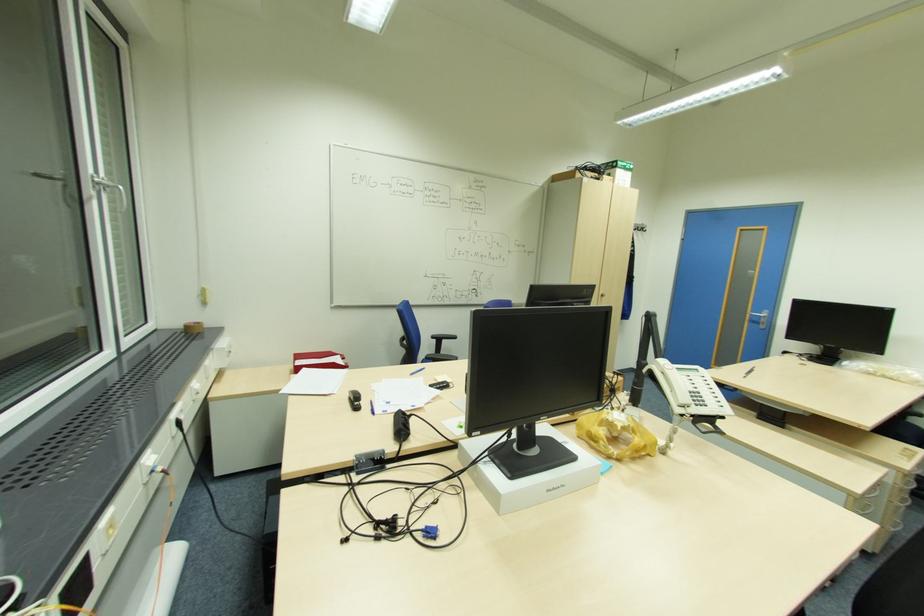
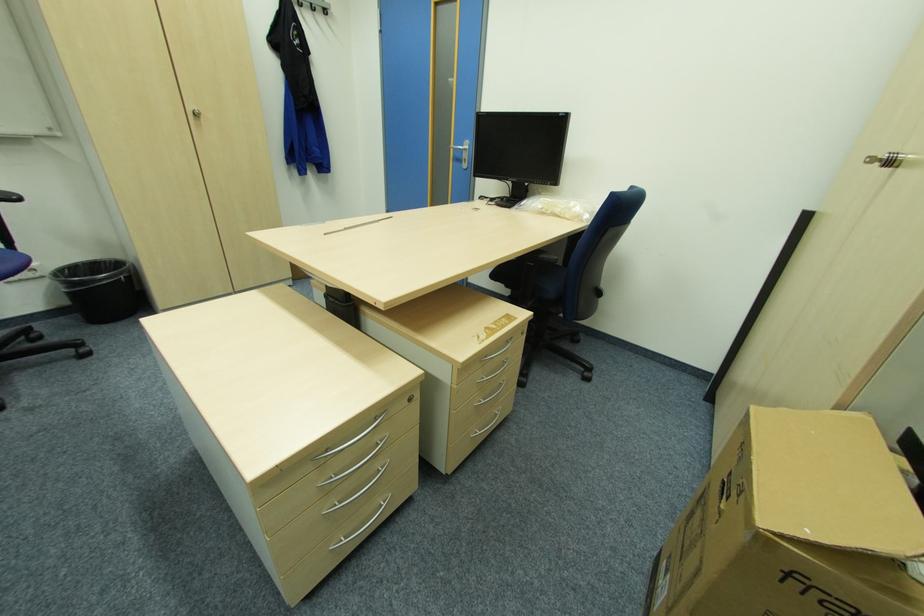
The point at (767, 315) is marked in the first image. Where is the corresponding point in the second image?

(468, 148)